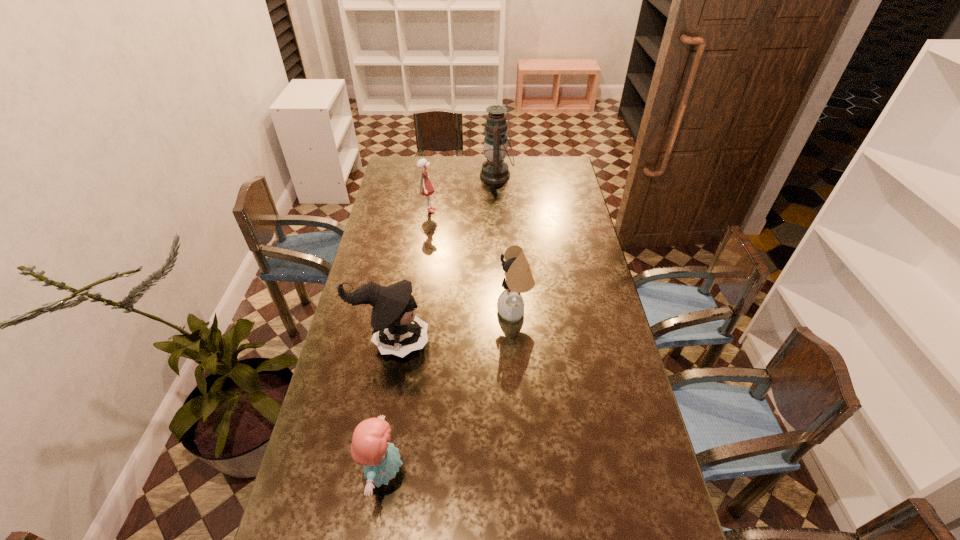
I want to click on vacant space positioned on the front-facing side of the nearest object, so click(x=478, y=472).

Locate an element on the screen. The width and height of the screenshot is (960, 540). object situated at the far edge is located at coordinates (494, 170).

Locate an element on the screen. The width and height of the screenshot is (960, 540). free space at the left edge is located at coordinates click(x=358, y=322).

Where is `free space at the right edge of the desktop`? The height and width of the screenshot is (540, 960). free space at the right edge of the desktop is located at coordinates (589, 339).

In the image, there is a desktop. At what (x,y) coordinates should I click in order to perform the action: click on vacant space at the far left corner. Please return your answer as a coordinate pair (x, y). Looking at the image, I should click on (394, 178).

Find the location of a particular element. Image resolution: width=960 pixels, height=540 pixels. vacant space at the far right corner is located at coordinates (564, 170).

Locate an element on the screen. This screenshot has height=540, width=960. vacant space that is in between the farthest object and the rightmost doll is located at coordinates point(506,244).

The width and height of the screenshot is (960, 540). I want to click on vacant space that's between the oil lamp and the nearest doll, so click(441, 324).

Locate an element on the screen. The width and height of the screenshot is (960, 540). vacant area that lies between the farthest doll and the rightmost doll is located at coordinates (471, 261).

I want to click on empty space that is in between the nearest object and the rightmost doll, so click(449, 392).